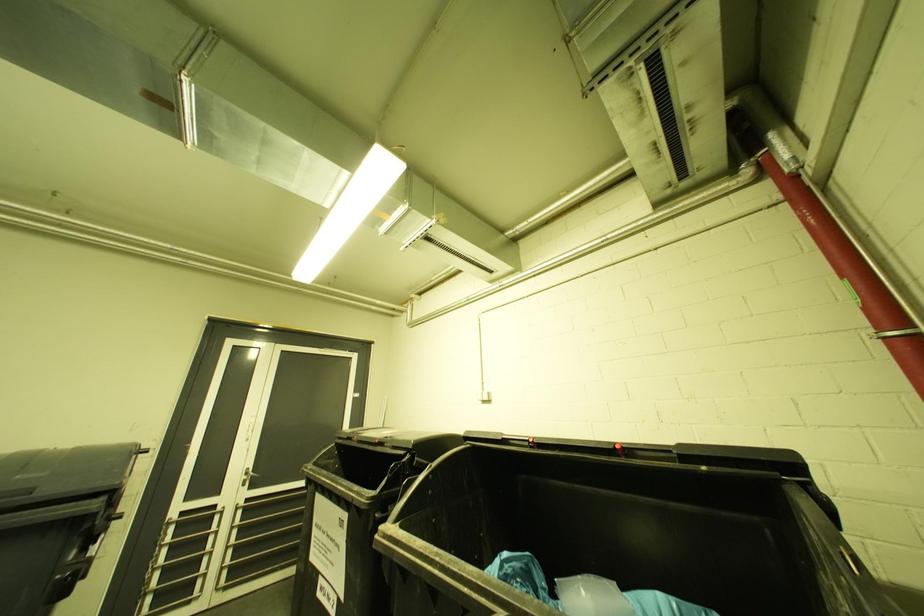
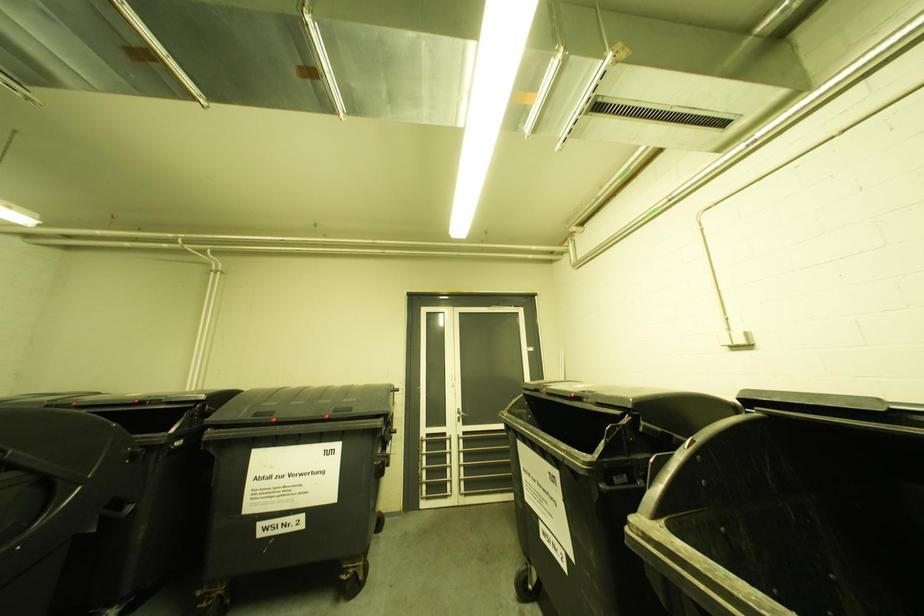
Question: The camera is either moving clockwise (left) or counter-clockwise (right) around the object. The first image is from the beginning of the video and the second image is from the end. Is the camera moving left or right when shooting the video?

Choices:
 (A) Left
 (B) Right

Answer: (B)